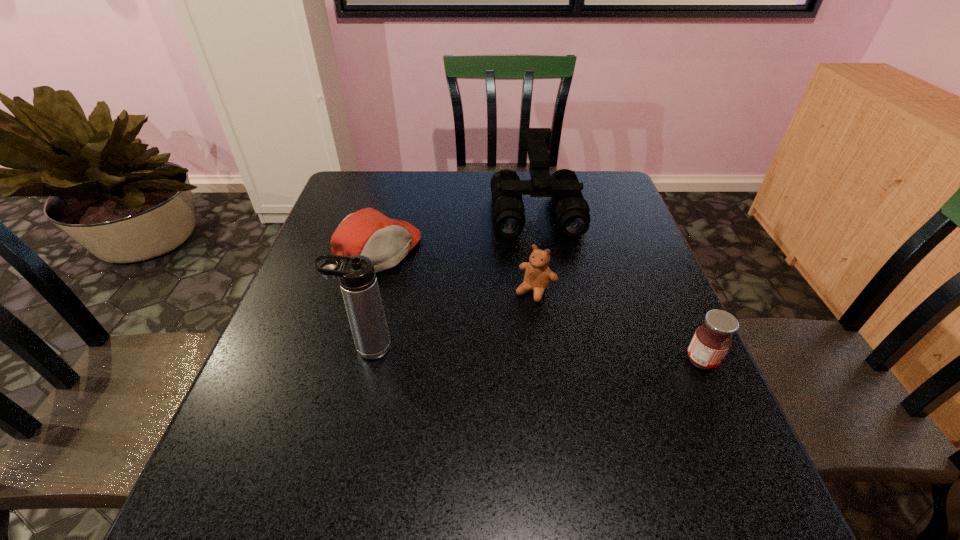
This screenshot has width=960, height=540. In order to click on jam present at the right edge in this screenshot , I will do `click(711, 341)`.

Identify the location of binoculars that is at the right edge. The height and width of the screenshot is (540, 960). 571,209.

Where is `object at the far right corner`? object at the far right corner is located at coordinates (571, 209).

This screenshot has width=960, height=540. Find the location of `free space at the far edge of the desktop`. free space at the far edge of the desktop is located at coordinates (404, 177).

In the image, there is a desktop. At what (x,y) coordinates should I click in order to perform the action: click on vacant space at the near edge. Please return your answer as a coordinate pair (x, y). This screenshot has height=540, width=960. Looking at the image, I should click on click(521, 427).

This screenshot has height=540, width=960. In the image, there is a desktop. What are the coordinates of `free region at the left edge` in the screenshot? It's located at (336, 301).

In the image, there is a desktop. Identify the location of vacant space at the right edge. Image resolution: width=960 pixels, height=540 pixels. (623, 215).

Find the location of a particular element. Image resolution: width=960 pixels, height=540 pixels. unoccupied position between the teddy bear and the rightmost object is located at coordinates pyautogui.click(x=618, y=326).

Find the location of `free space that is in between the cap and the jam`. free space that is in between the cap and the jam is located at coordinates (540, 305).

The height and width of the screenshot is (540, 960). I want to click on free space between the third nearest object and the tallest object, so click(x=451, y=319).